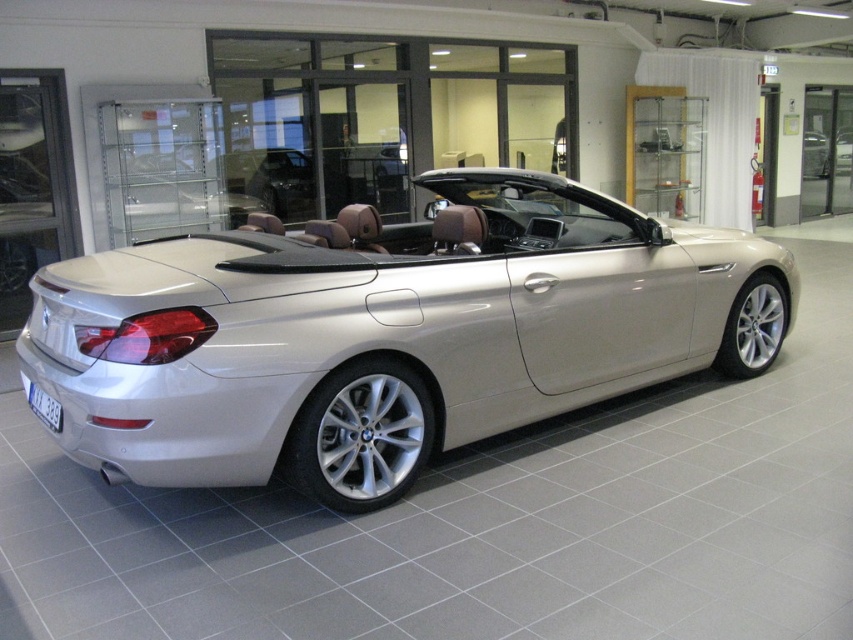
The width and height of the screenshot is (853, 640). What do you see at coordinates (387, 333) in the screenshot?
I see `satin silver convertible at center` at bounding box center [387, 333].

Is satin silver convertible at center thinner than black plastic license plate at rear?

No.

Is point (543, 416) farther from viewer compared to point (33, 401)?

Yes, it is behind point (33, 401).

Find the location of a particular element. This screenshot has width=853, height=640. satin silver convertible at center is located at coordinates (387, 333).